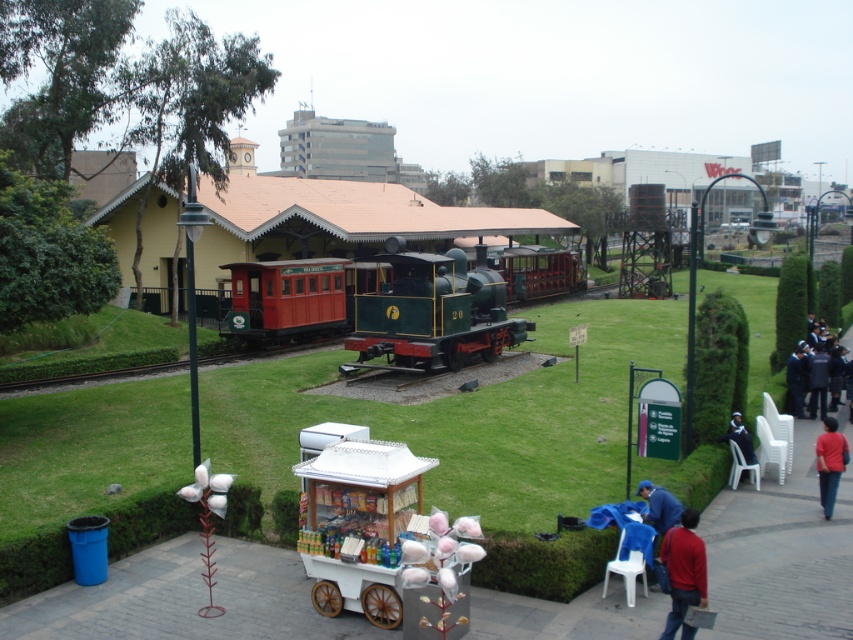
You are at the miniature railway station and see a white wood cotton candy cart at center and a red cotton candy at lower right. Which one is closer to the train?

The red cotton candy at lower right is closer to the train because the white wood cotton candy cart at center is positioned on the left side of it, implying the red cotton candy at lower right is nearer to the train.

You are a parent holding a small child who wants to reach both the red cotton candy at lower right and the blue fabric at lower right. The child is currently standing at the center of the walkway. Can the child safely reach both items without moving more than 10 feet from their current position?

The red cotton candy at lower right and blue fabric at lower right are 12.56 feet apart. Since the distance between them exceeds 10 feet, the child cannot safely reach both items without moving more than 10 feet from their current position.

You are a visitor at the miniature railway exhibit and notice the red cotton candy at lower right and the blue fabric at lower right. Which object is wider?

The red cotton candy at lower right is wider than the blue fabric at lower right according to the description.